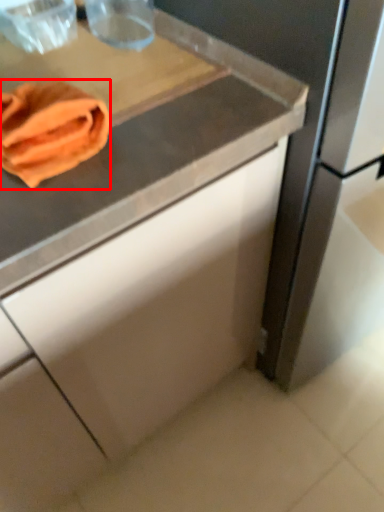
Question: Observing the image, what is the correct spatial positioning of material (annotated by the red box) in reference to cutting board?

Choices:
 (A) left
 (B) right

Answer: (A)